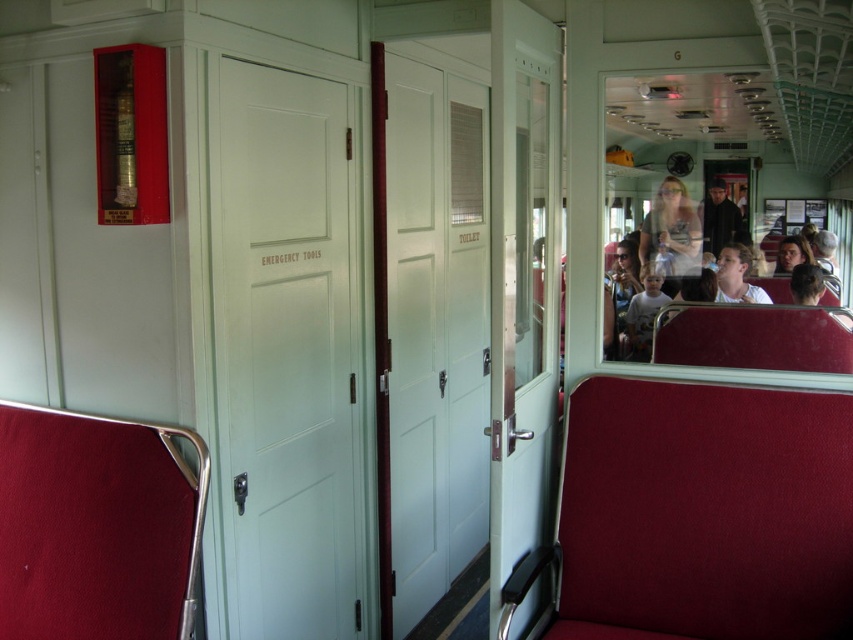
You are a passenger on this vintage train car and notice a matte black jacket at upper right and a smooth brown hair at right. If you want to reach both items, which one is closer to your current position?

The matte black jacket at upper right is 11.79 inches away from smooth brown hair at right. Since the question doesn not specify your exact position, we can only compare their relative distance. However, without additional information about your location, it is impossible to determine which is closer to you.